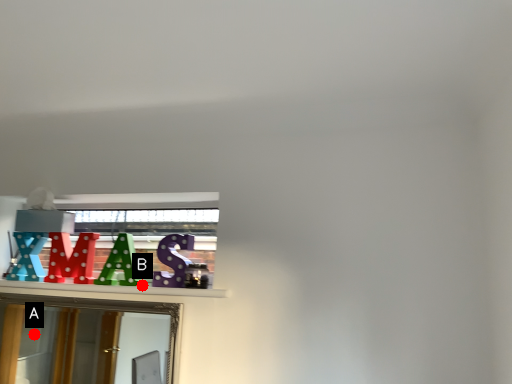
Question: Two points are circled on the image, labeled by A and B beside each circle. Which of the following is the farthest from the observer?

Choices:
 (A) A is further
 (B) B is further

Answer: (A)